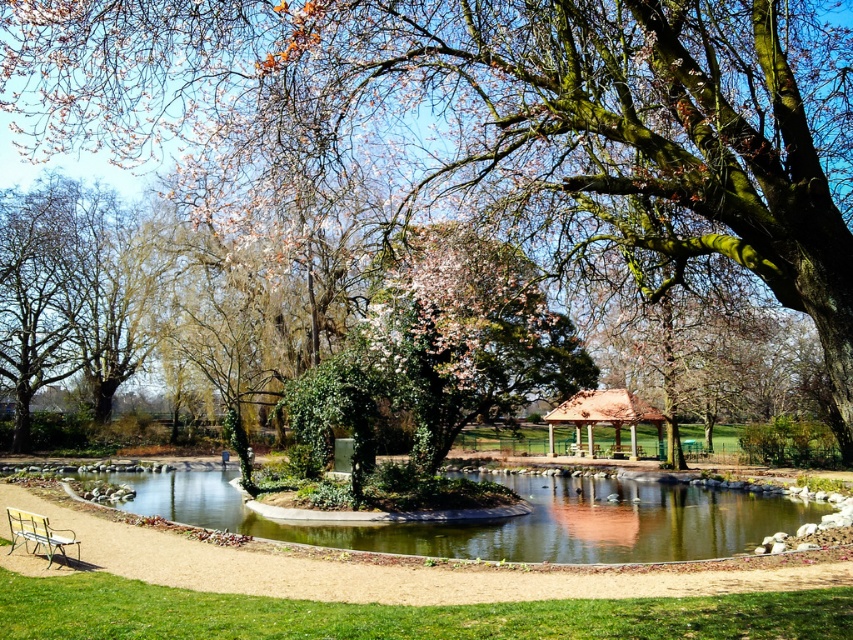
You are planning to place a picnic blanket in the park and have to choose between the area under the green mossy tree at center or near the brown wooden gazebo at center. Which location offers more space horizontally due to the tree being wider?

The green mossy tree at center has a greater width than the brown wooden gazebo at center, so the area under the green mossy tree at center provides more horizontal space for placing the picnic blanket.